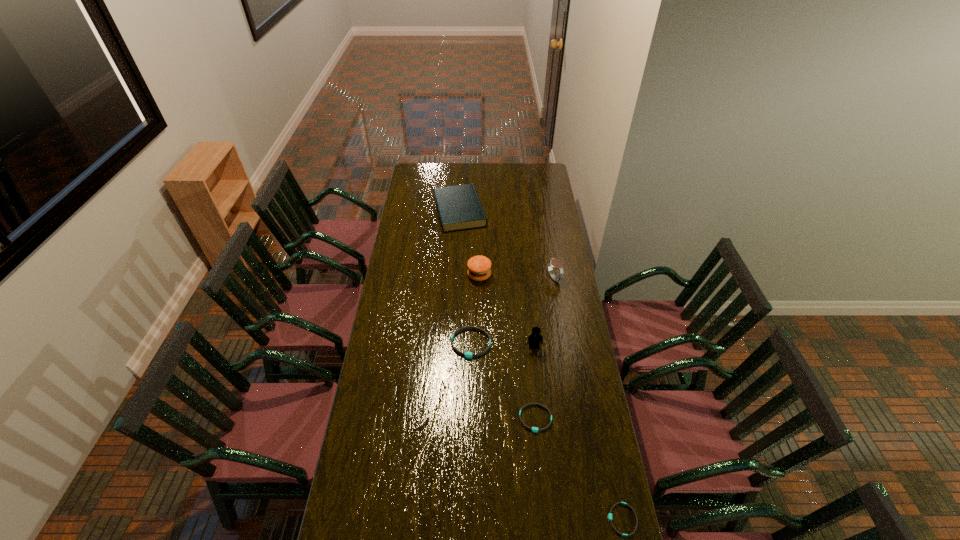
I want to click on vacant space in between the Lego and the book, so click(x=497, y=279).

The height and width of the screenshot is (540, 960). I want to click on vacant space in between the second object from right to left and the sixth farthest object, so click(545, 348).

Where is `empty space between the Lego and the patty`? The image size is (960, 540). empty space between the Lego and the patty is located at coordinates (507, 311).

Identify the location of unoccupied area between the Lego and the watch. The image size is (960, 540). (544, 313).

The image size is (960, 540). Identify the location of free space between the watch and the rightmost wristband. 588,399.

Where is `empty space between the sixth farthest object and the Lego`? empty space between the sixth farthest object and the Lego is located at coordinates (535, 383).

I want to click on vacant space that's between the second object from right to left and the patty, so click(516, 276).

Point out which object is positioned as the fourth nearest to the rightmost object. Please provide its 2D coordinates. Your answer should be formatted as a tuple, i.e. [(x, y)], where the tuple contains the x and y coordinates of a point satisfying the conditions above.

[(553, 262)]

Locate which object ranks fourth in proximity to the patty. Please provide its 2D coordinates. Your answer should be formatted as a tuple, i.e. [(x, y)], where the tuple contains the x and y coordinates of a point satisfying the conditions above.

[(534, 339)]

At what (x,y) coordinates should I click in order to perform the action: click on wristband that is the second closest one to the second wristband from right to left. Please return your answer as a coordinate pair (x, y). This screenshot has width=960, height=540. Looking at the image, I should click on (610, 514).